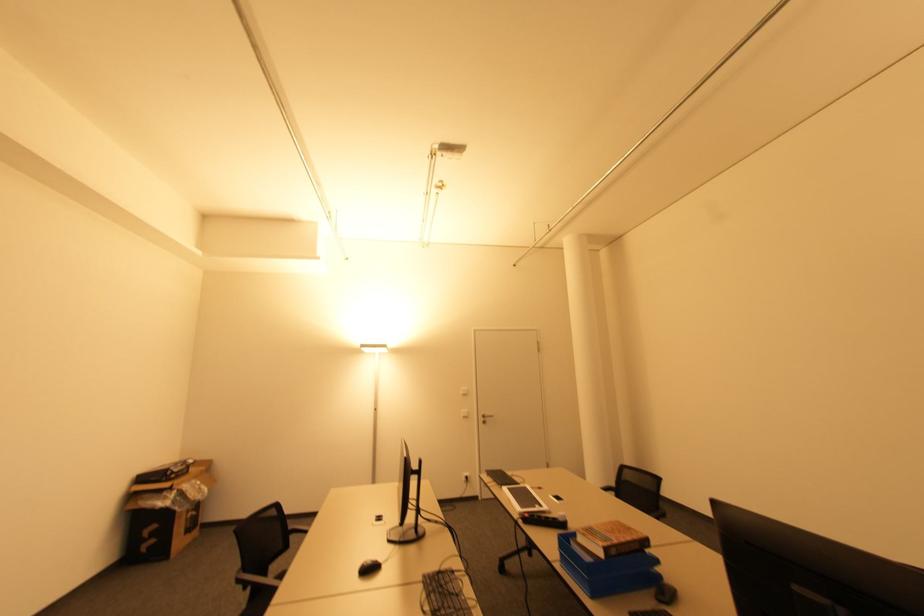
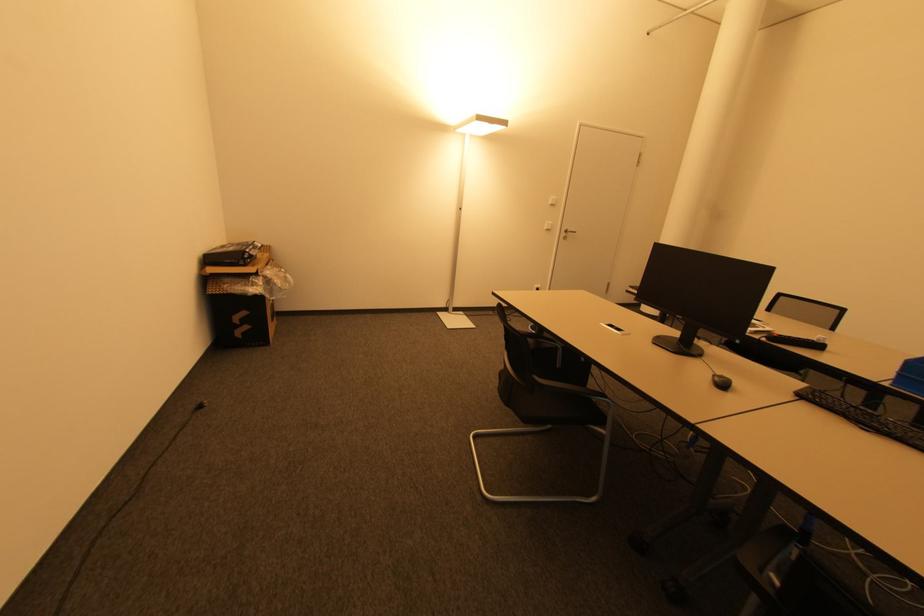
In the second image, find the point that corresponds to point 175,476 in the first image.

(250, 261)